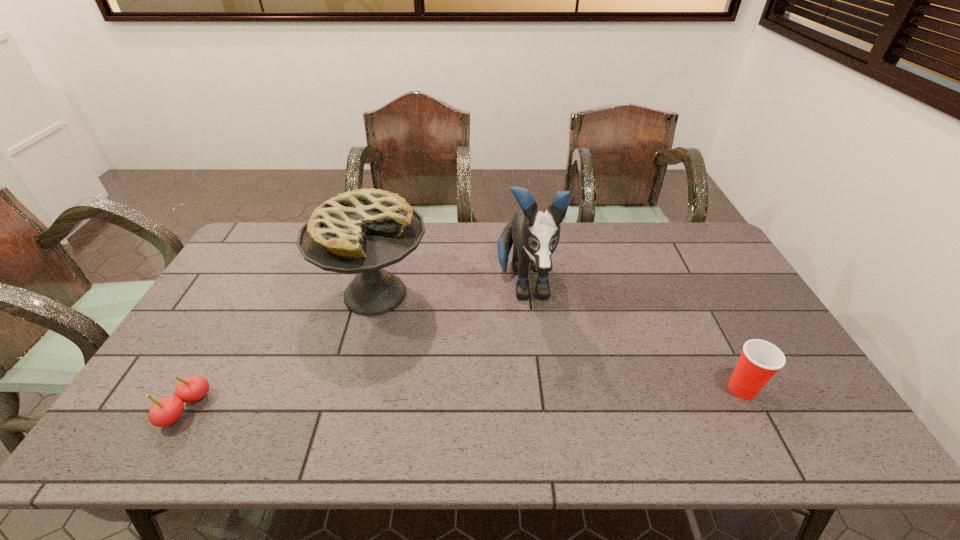
Where is `the shortest object`? This screenshot has width=960, height=540. the shortest object is located at coordinates (166, 411).

The width and height of the screenshot is (960, 540). What are the coordinates of `the leftmost object` in the screenshot? It's located at (166, 411).

The image size is (960, 540). Find the location of `the rightmost object`. the rightmost object is located at coordinates (760, 360).

At what (x,y) coordinates should I click in order to perform the action: click on the third tallest object. Please return your answer as a coordinate pair (x, y). This screenshot has height=540, width=960. Looking at the image, I should click on (760, 360).

Where is `the third object from right to left`? The width and height of the screenshot is (960, 540). the third object from right to left is located at coordinates (362, 231).

Identify the location of the second tallest object. This screenshot has width=960, height=540. (362, 231).

You are a GUI agent. You are given a task and a screenshot of the screen. Output one action in this format:
    pyautogui.click(x=<x>, y=<y>)
    Task: Click on the puppy
    The width and height of the screenshot is (960, 540).
    Given the screenshot: What is the action you would take?
    pyautogui.click(x=535, y=234)

The width and height of the screenshot is (960, 540). What are the coordinates of `the tallest object` in the screenshot? It's located at (535, 234).

What are the coordinates of `blank space located 0.280m on the back of the leftmost object` in the screenshot? It's located at (244, 308).

Locate an element on the screen. free space located 0.300m on the left of the Dixie cup is located at coordinates (605, 389).